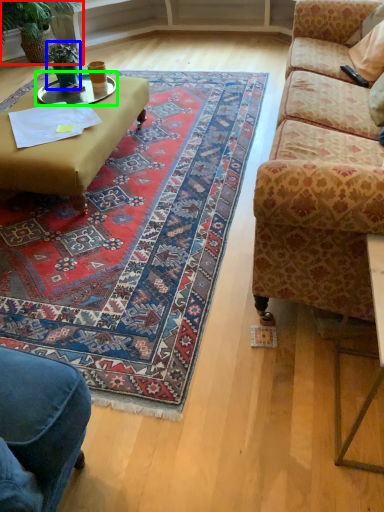
Question: Which object is the closest to the houseplant (highlighted by a red box)? Choose among these: houseplant (highlighted by a blue box) or glass table (highlighted by a green box).

Choices:
 (A) houseplant
 (B) glass table

Answer: (A)